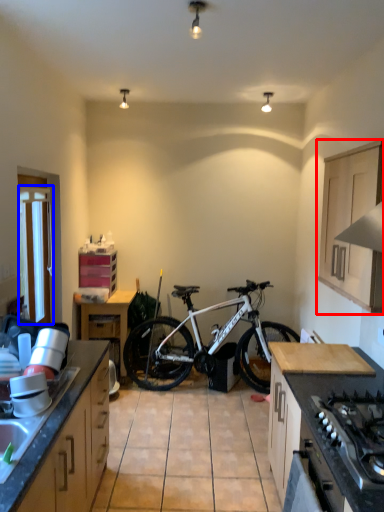
Question: Which object appears closest to the camera in this image, cabinetry (highlighted by a red box) or window screen (highlighted by a blue box)?

Choices:
 (A) cabinetry
 (B) window screen

Answer: (A)